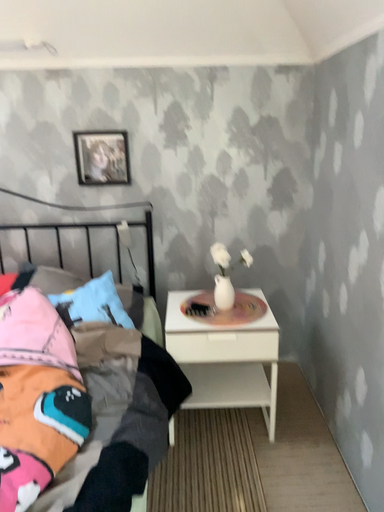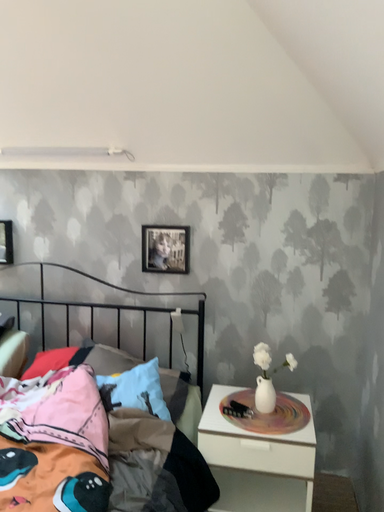
Question: How did the camera likely rotate when shooting the video?

Choices:
 (A) rotated right
 (B) rotated left

Answer: (B)